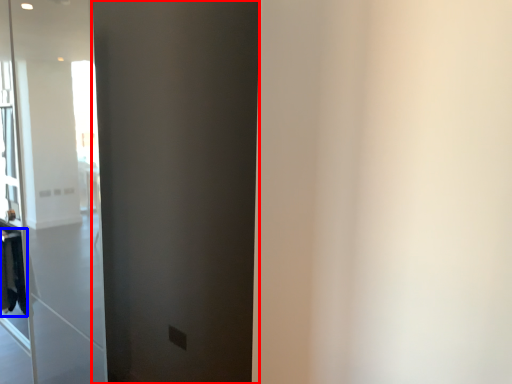
Question: Which object is further to the camera taking this photo, barn door (highlighted by a red box) or laundry (highlighted by a blue box)?

Choices:
 (A) barn door
 (B) laundry

Answer: (B)